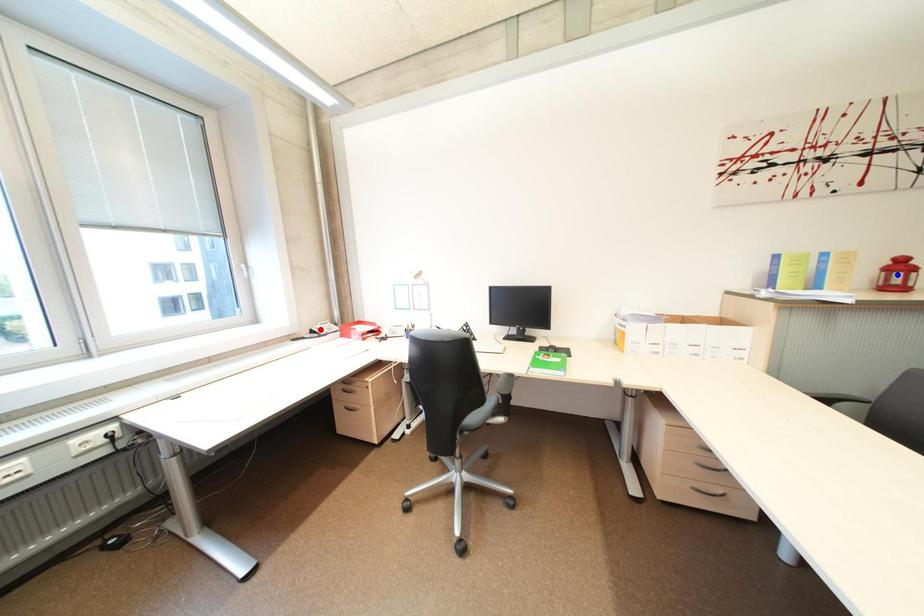
Question: Two points are marked on the image. Which point is closer to the camera?

Choices:
 (A) Blue point is closer.
 (B) Red point is closer.

Answer: (A)